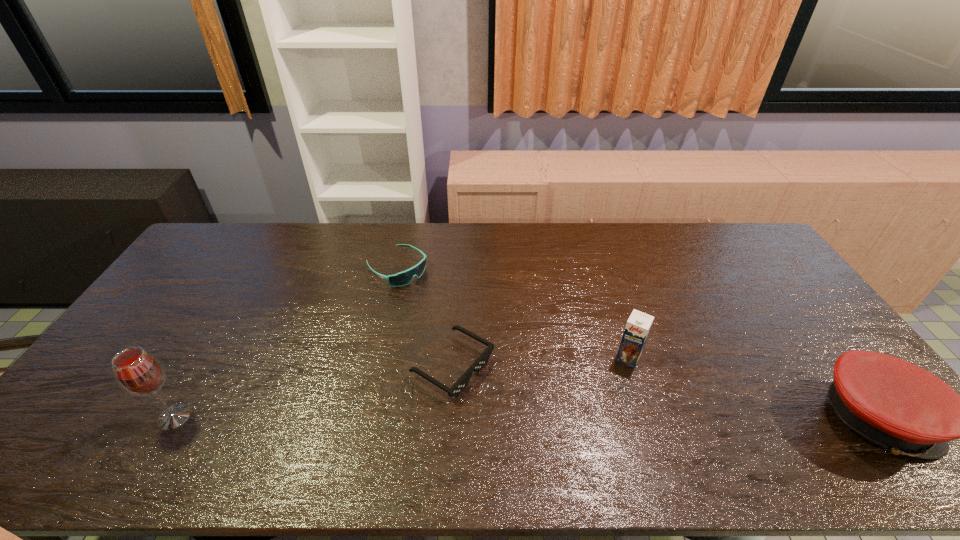
Identify which object is the second closest to the nearer sunglasses. Please provide its 2D coordinates. Your answer should be formatted as a tuple, i.e. [(x, y)], where the tuple contains the x and y coordinates of a point satisfying the conditions above.

[(637, 328)]

Identify which object is the third closest to the leftmost object. Please provide its 2D coordinates. Your answer should be formatted as a tuple, i.e. [(x, y)], where the tuple contains the x and y coordinates of a point satisfying the conditions above.

[(637, 328)]